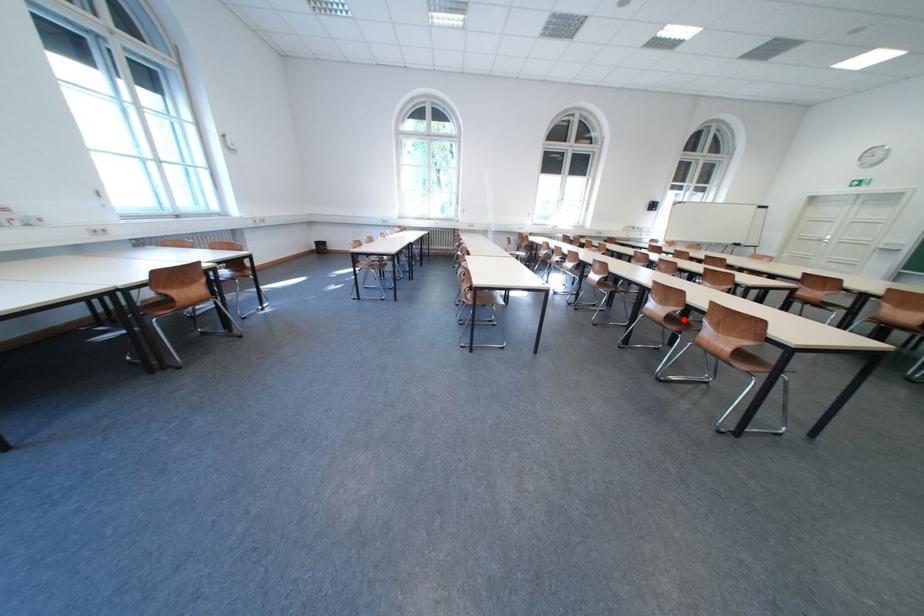
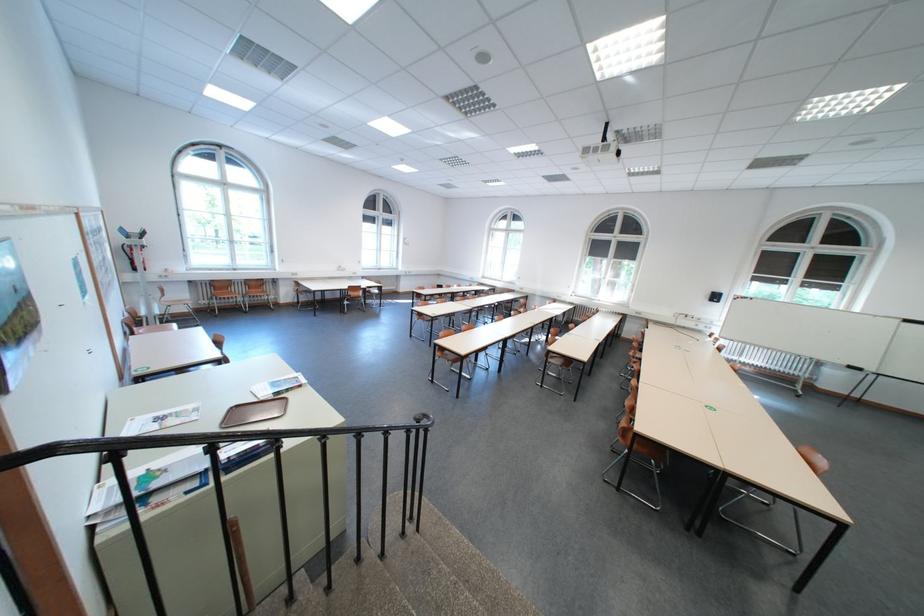
Question: I am providing you with two images of the same scene from different viewpoints. A red point is marked on the first image. Can you still see the location of the red point in image 2?

Choices:
 (A) Yes
 (B) No

Answer: (B)